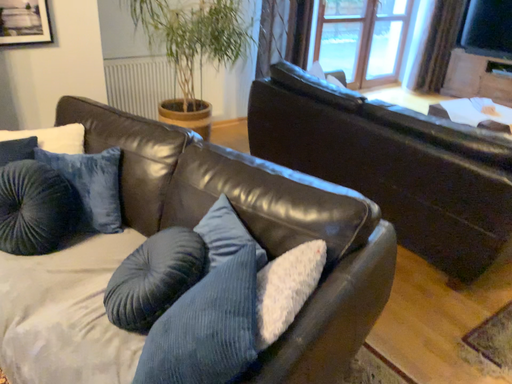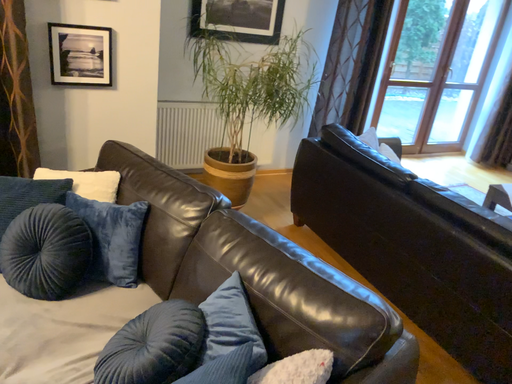
Question: How did the camera likely rotate when shooting the video?

Choices:
 (A) rotated left
 (B) rotated right

Answer: (A)